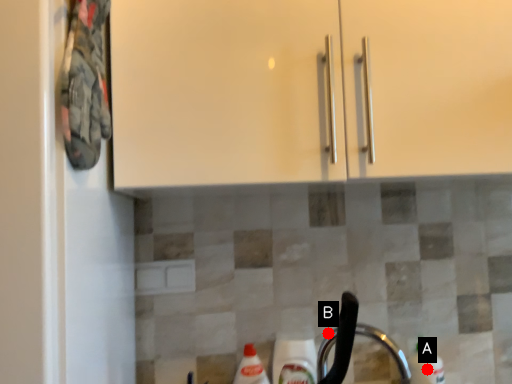
Question: Two points are circled on the image, labeled by A and B beside each circle. Which point is closer to the camera?

Choices:
 (A) A is closer
 (B) B is closer

Answer: (A)